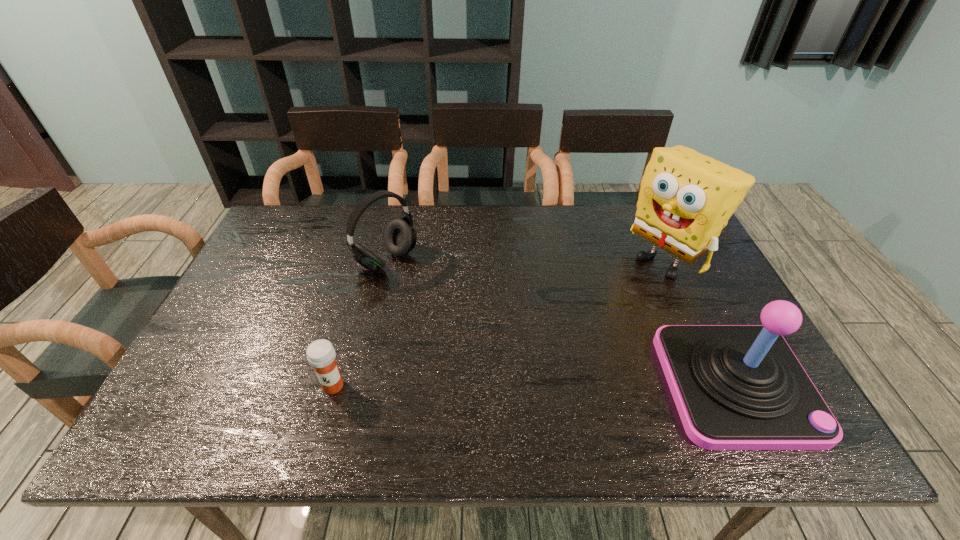
Identify the location of vacant space on the desktop that is between the medicine and the joystick and is positioned on the face of the tallest object. (477, 386).

The width and height of the screenshot is (960, 540). In order to click on vacant space on the desktop that is between the medicine and the joystick and is positioned on the ear cups of the headset in this screenshot , I will do `click(569, 385)`.